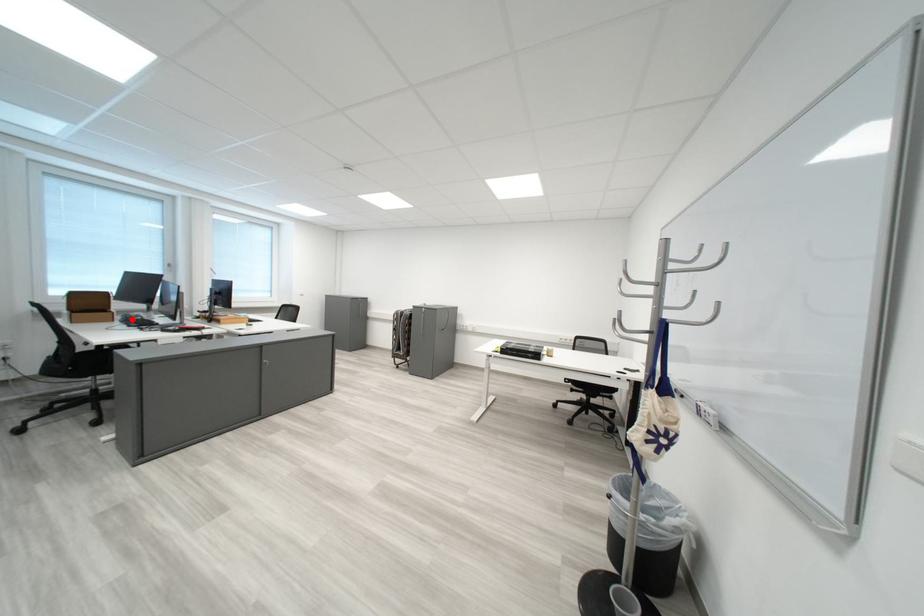
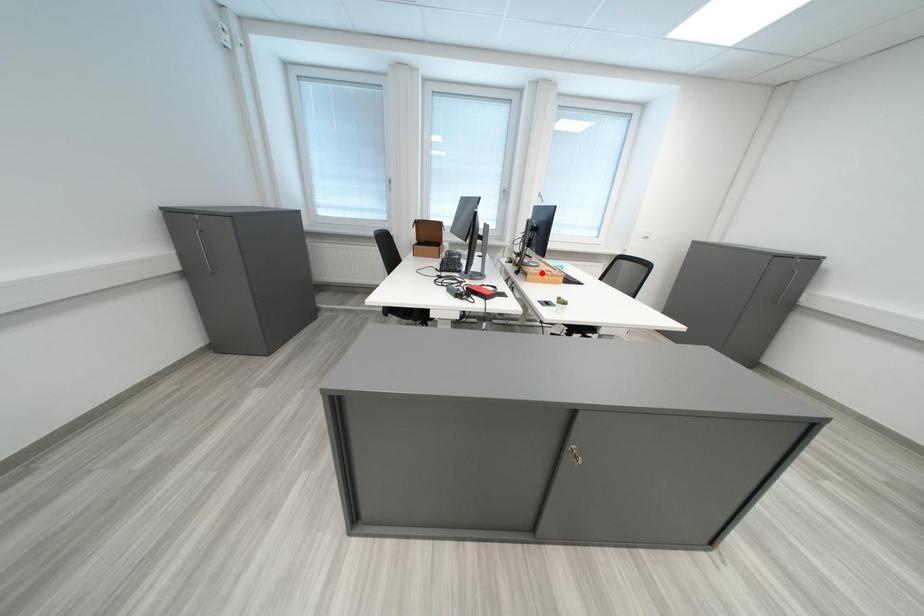
I am providing you with two images of the same scene from different viewpoints. A red point is marked on the first image and another point is marked on the second image. Is the marked point in image1 the same physical position as the marked point in image2?

No